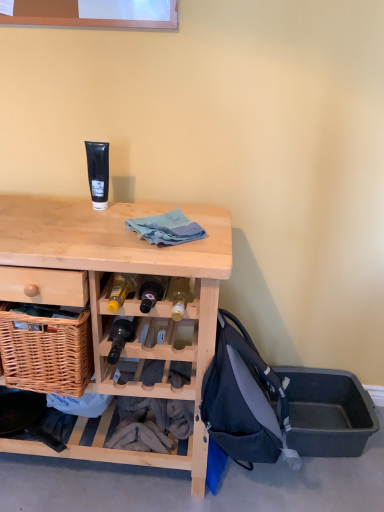
Question: Considering the relative sizes of matte black bottle at center and dark blue fabric backpack at lower right in the image provided, is matte black bottle at center wider than dark blue fabric backpack at lower right?

Choices:
 (A) no
 (B) yes

Answer: (A)

Question: Is matte black bottle at center shorter than dark blue fabric backpack at lower right?

Choices:
 (A) yes
 (B) no

Answer: (A)

Question: Is matte black bottle at center oriented away from dark blue fabric backpack at lower right?

Choices:
 (A) yes
 (B) no

Answer: (B)

Question: Does matte black bottle at center appear on the left side of dark blue fabric backpack at lower right?

Choices:
 (A) no
 (B) yes

Answer: (B)

Question: From the image's perspective, does matte black bottle at center appear lower than dark blue fabric backpack at lower right?

Choices:
 (A) yes
 (B) no

Answer: (B)

Question: Is matte black bottle at center with dark blue fabric backpack at lower right?

Choices:
 (A) yes
 (B) no

Answer: (B)

Question: Is light wood desk at center a part of gray plastic storage box at lower right?

Choices:
 (A) no
 (B) yes

Answer: (A)

Question: Is gray plastic storage box at lower right further to camera compared to light wood desk at center?

Choices:
 (A) no
 (B) yes

Answer: (B)

Question: Is gray plastic storage box at lower right touching light wood desk at center?

Choices:
 (A) yes
 (B) no

Answer: (B)

Question: Is gray plastic storage box at lower right positioned beyond the bounds of light wood desk at center?

Choices:
 (A) yes
 (B) no

Answer: (A)

Question: Is gray plastic storage box at lower right taller than light wood desk at center?

Choices:
 (A) no
 (B) yes

Answer: (A)

Question: Does gray plastic storage box at lower right have a lesser width compared to light wood desk at center?

Choices:
 (A) yes
 (B) no

Answer: (A)

Question: Does dark blue fabric backpack at lower right lie behind light wood desk at center?

Choices:
 (A) no
 (B) yes

Answer: (B)